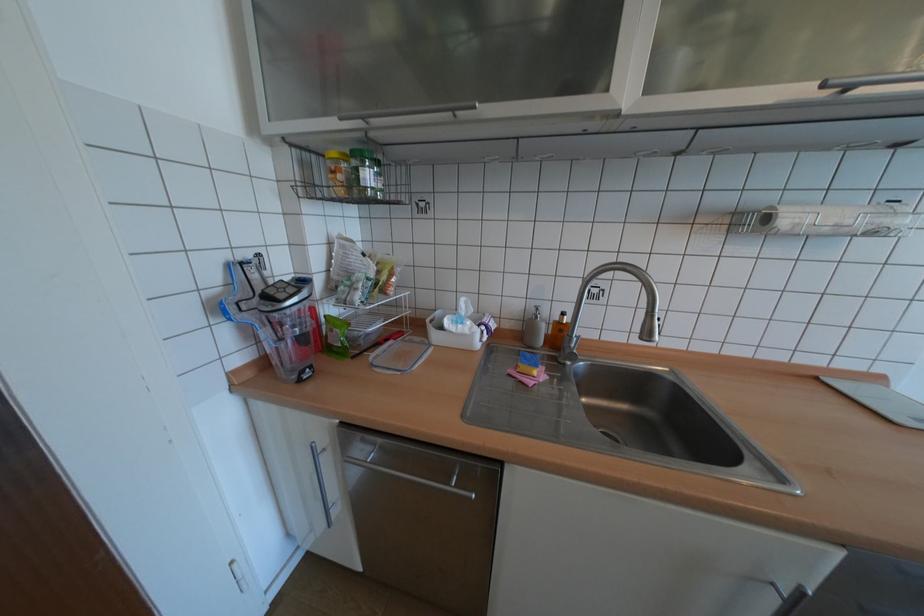
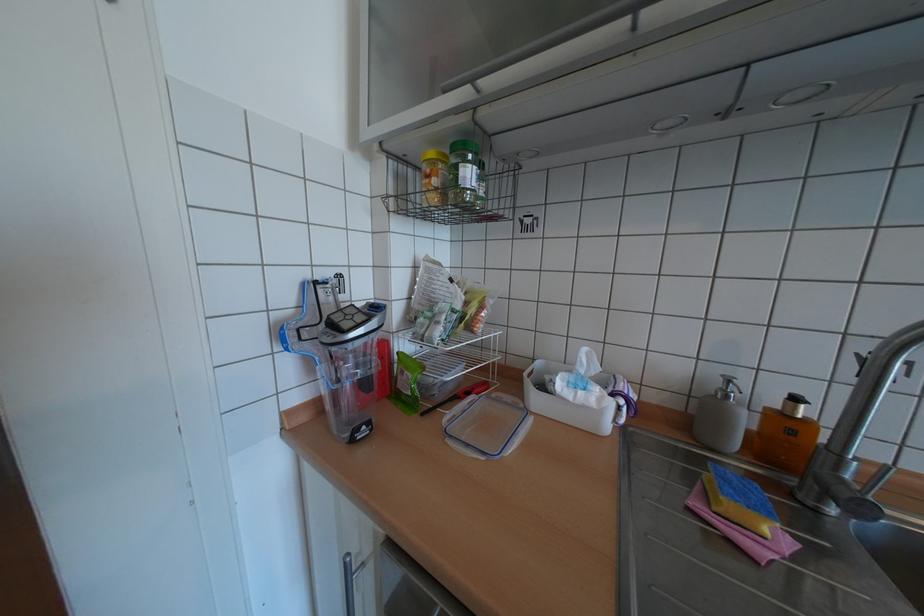
Which direction would the cameraman need to move to produce the second image?

The cameraman walked toward left, forward.